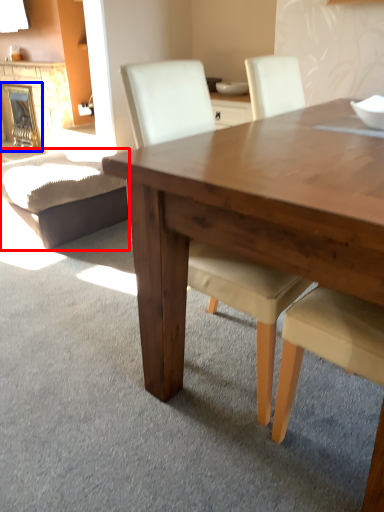
Question: Which object is further to the camera taking this photo, swivel chair (highlighted by a red box) or fireplace (highlighted by a blue box)?

Choices:
 (A) swivel chair
 (B) fireplace

Answer: (B)